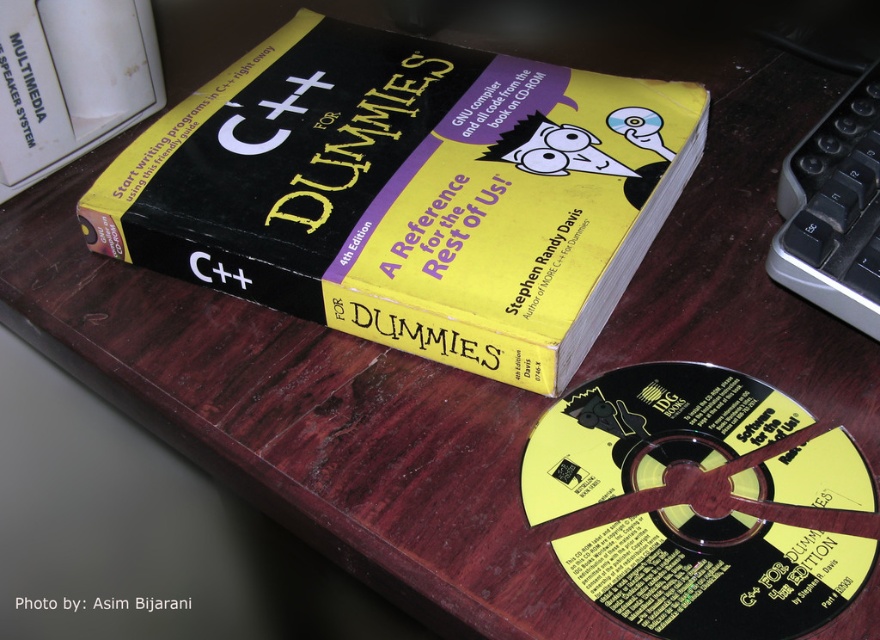
You are organizing a library shelf and need to place the black matte book at center and the black plastic cd at lower right. The shelf has a space that can only accommodate items smaller than the book. Can the CD fit in this space?

The black matte book at center is bigger than the black plastic cd at lower right, so the CD can fit in the space since it is smaller than the book.

You have a storage box that can only fit items wider than 10 cm. You need to place both the black matte book at center and the black plastic cd at lower right into the box. Which item will definitely fit based on their widths?

The black matte book at center has a larger width than the black plastic cd at lower right. Since the storage box requires items wider than 10 cm, the black plastic cd at lower right might not meet the width requirement, but the black matte book at center, being wider, will definitely fit.